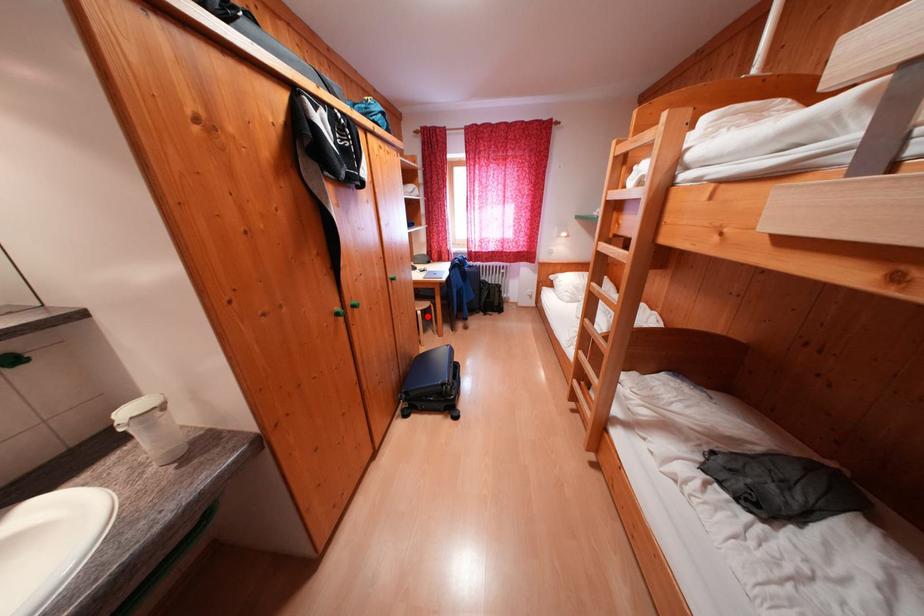
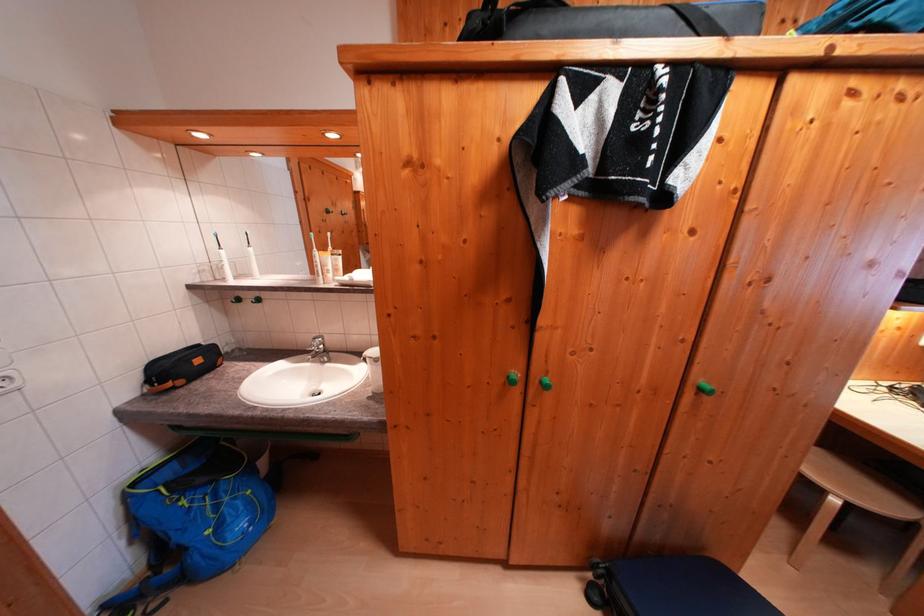
In the second image, find the point that corresponds to the highlighted location in the first image.

(843, 505)